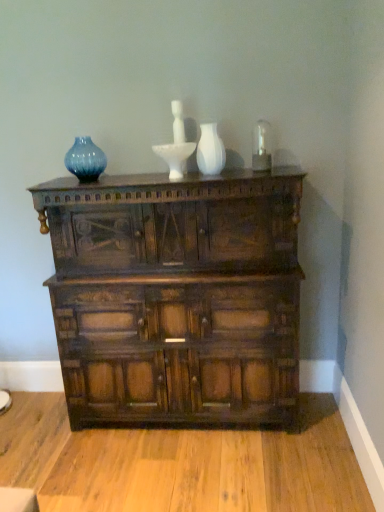
Locate an element on the screen. The image size is (384, 512). empty space that is ontop of blue glass vase at upper left (from a real-world perspective) is located at coordinates (76, 132).